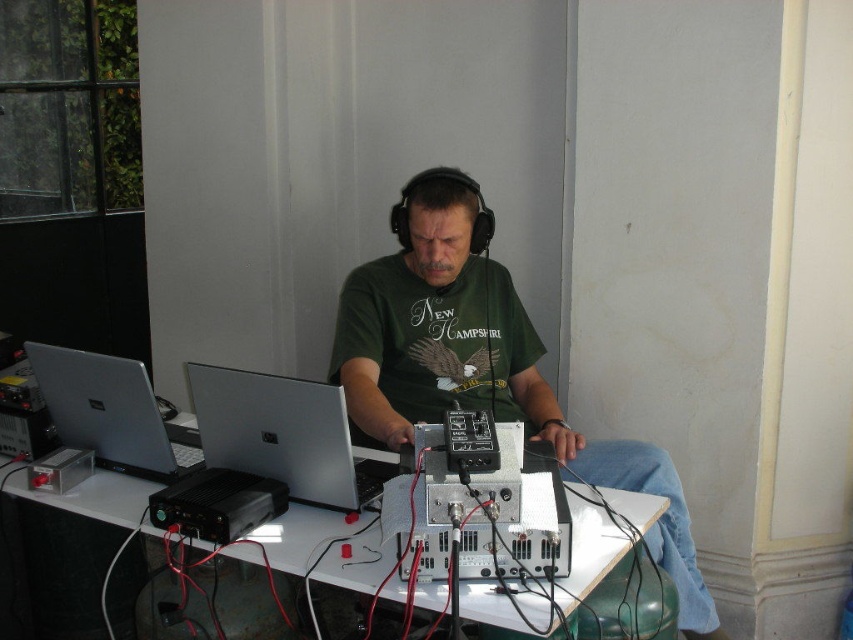
You are a photographer taking a picture of the scene. The green matte shirt at center and the white plastic table at center are both in your viewfinder. Which object will appear larger in the photo?

The green matte shirt at center will appear larger in the photo because it is bigger than the white plastic table at center according to the description.

Based on the photo, you are standing at point (402, 401) and want to take a photo of the man using your camera. The camera requires a minimum distance of 2 meters to focus properly. Can you take a clear photo from your current position?

The distance between point (402, 401) and the camera is 2.34 meters, which is greater than the minimum required distance of 2 meters. Therefore, you can take a clear photo from your current position.